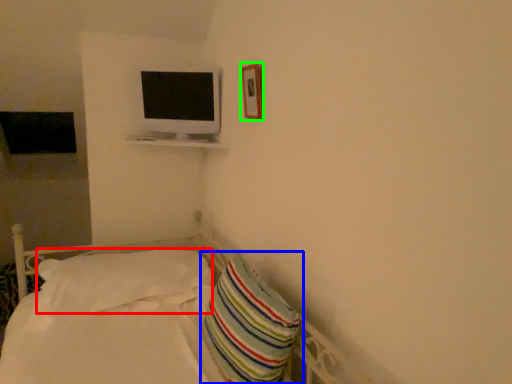
Question: Which is nearer to the pillow (highlighted by a red box)? pillow (highlighted by a blue box) or picture frame (highlighted by a green box).

Choices:
 (A) pillow
 (B) picture frame

Answer: (A)